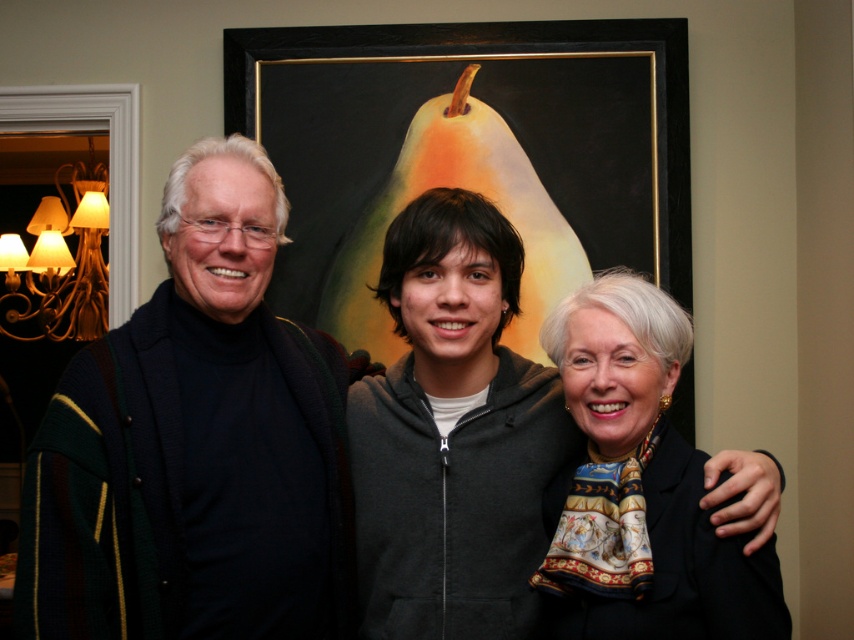
Between silky black scarf at center and silky black blazer at right, which one appears on the left side from the viewer's perspective?

silky black scarf at center is more to the left.

Consider the image. Who is positioned more to the right, silky black scarf at center or silky black blazer at right?

From the viewer's perspective, silky black blazer at right appears more on the right side.

Which is behind, point (410, 284) or point (588, 529)?

The point (410, 284) is behind.

You are a GUI agent. You are given a task and a screenshot of the screen. Output one action in this format:
    pyautogui.click(x=<x>, y=<y>)
    Task: Click on the silky black scarf at center
    Image resolution: width=854 pixels, height=640 pixels.
    Given the screenshot: What is the action you would take?
    pyautogui.click(x=452, y=433)

Looking at this image, who is lower down, matte black sweater at center or dark blue turtleneck sweater at left?

matte black sweater at center is lower down.

Who is more forward, (48, 452) or (186, 180)?

Point (48, 452)

Image resolution: width=854 pixels, height=640 pixels. What do you see at coordinates (197, 444) in the screenshot?
I see `matte black sweater at center` at bounding box center [197, 444].

In order to click on matte black sweater at center in this screenshot , I will do point(197,444).

Looking at this image, which is more to the right, dark blue turtleneck sweater at left or silky black scarf at center?

Positioned to the right is silky black scarf at center.

Who is more forward, (323, 376) or (423, 396)?

Point (423, 396) is more forward.

At what (x,y) coordinates should I click in order to perform the action: click on dark blue turtleneck sweater at left. Please return your answer as a coordinate pair (x, y). This screenshot has width=854, height=640. Looking at the image, I should click on (197, 444).